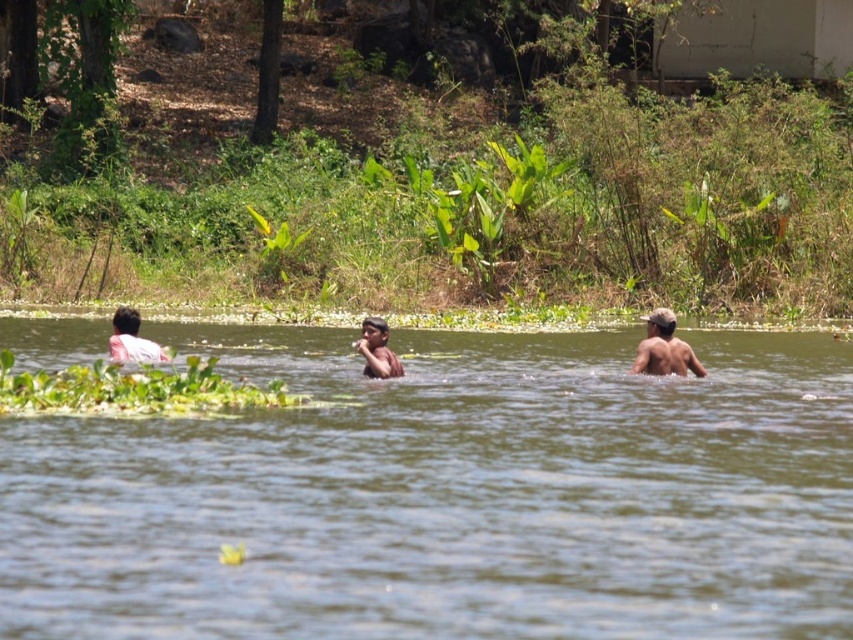
Between brown skin at right and smooth skin person at center, which one appears on the right side from the viewer's perspective?

Positioned to the right is brown skin at right.

Consider the image. Can you confirm if brown skin at right is wider than smooth skin person at center?

In fact, brown skin at right might be narrower than smooth skin person at center.

Between point (666, 321) and point (386, 340), which one is positioned in front?

Positioned in front is point (386, 340).

Locate an element on the screen. brown skin at right is located at coordinates (664, 348).

Is brown murky water at center above brown skin at right?

Actually, brown murky water at center is below brown skin at right.

Where is `brown murky water at center`? brown murky water at center is located at coordinates (448, 496).

Identify the location of brown murky water at center. (448, 496).

Is brown skin at right shorter than white cloth at left?

In fact, brown skin at right may be taller than white cloth at left.

Can you confirm if brown skin at right is positioned below white cloth at left?

Indeed, brown skin at right is positioned under white cloth at left.

The height and width of the screenshot is (640, 853). What do you see at coordinates (664, 348) in the screenshot?
I see `brown skin at right` at bounding box center [664, 348].

The image size is (853, 640). In order to click on brown skin at right in this screenshot , I will do `click(664, 348)`.